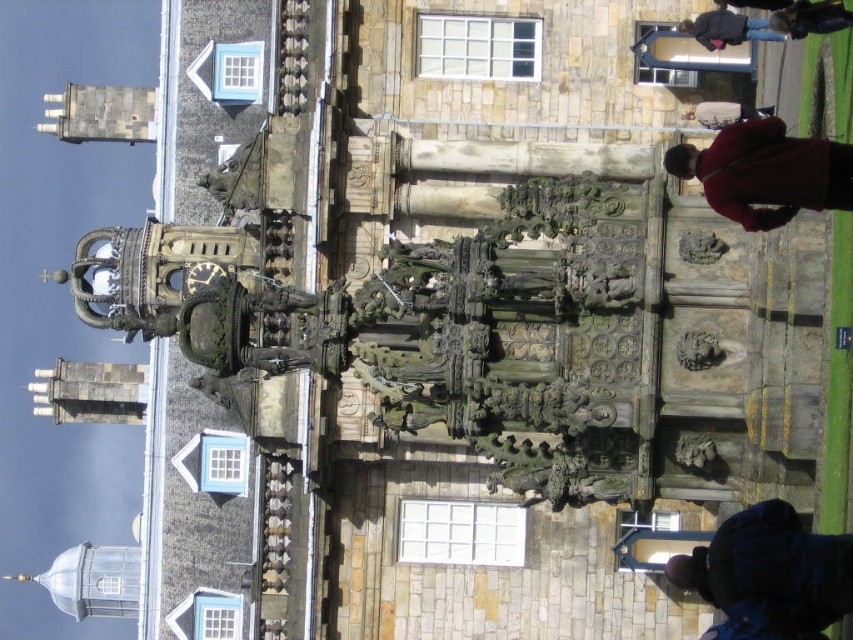
You are standing at the center of the fountain and want to throw a coin into the water. Where should you aim to hit the dark blue jacket at lower right? Please provide coordinates in the format of x,y.

The dark blue jacket at lower right is located at coordinates [769,573], so you should aim for that point to hit it.

You are a visitor at the fountain and need to decide which item to take with you. Both the red woolen sweater at upper right and the matte brown coat at upper right are available. If you want to carry the bigger one, which should you choose?

The red woolen sweater at upper right has a larger size compared to the matte brown coat at upper right, so you should choose the red woolen sweater at upper right.